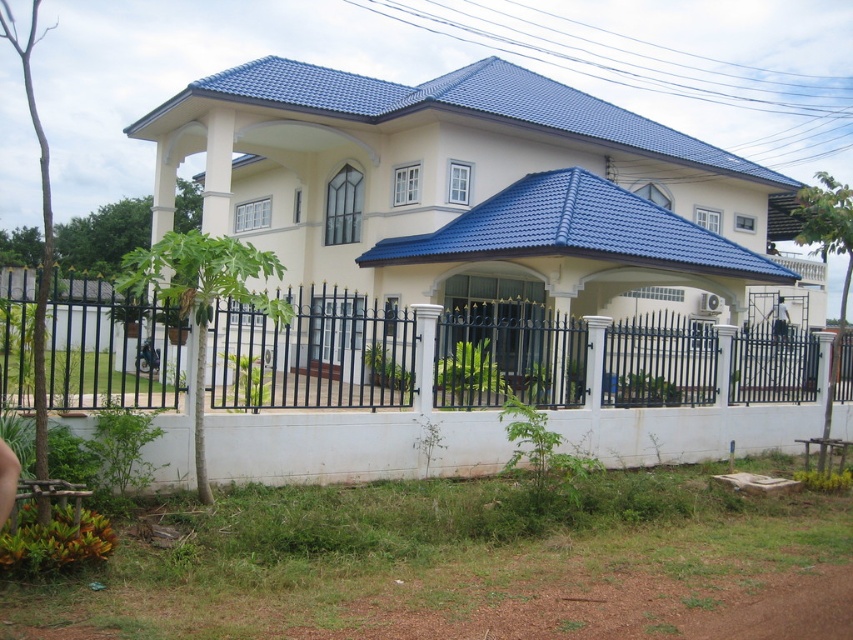
Is black metal fence at lower center further to camera compared to dark blue fabric shirt at center?

No.

Between black metal fence at lower center and dark blue fabric shirt at center, which one is positioned higher?

black metal fence at lower center is higher up.

Does point (10, 326) come farther from viewer compared to point (778, 337)?

That is True.

Identify the location of black metal fence at lower center. (312, 355).